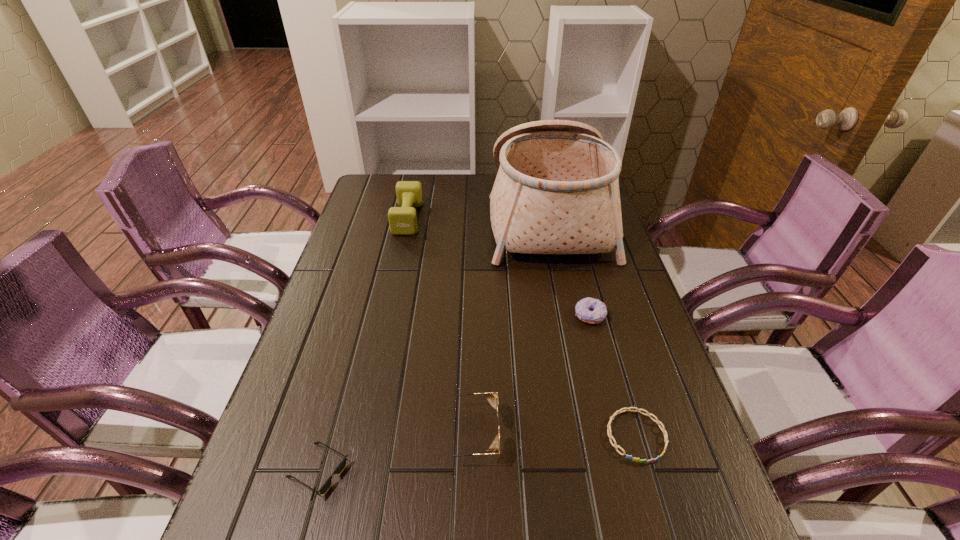
Where is `object that stands as the fourth closest to the shortest object`? This screenshot has width=960, height=540. object that stands as the fourth closest to the shortest object is located at coordinates (342, 465).

Locate which object ranks third in proximity to the bracelet. Please provide its 2D coordinates. Your answer should be formatted as a tuple, i.e. [(x, y)], where the tuple contains the x and y coordinates of a point satisfying the conditions above.

[(557, 190)]

Find the location of `free space that satisfies the following two spatial constraints: 1. on the front side of the doughnut; 2. on the lenses of the left sunglasses`. free space that satisfies the following two spatial constraints: 1. on the front side of the doughnut; 2. on the lenses of the left sunglasses is located at coordinates [x=630, y=470].

Where is `free point that satisfies the following two spatial constraints: 1. with the lid open on the third farthest object; 2. on the left side of the tallest object`? free point that satisfies the following two spatial constraints: 1. with the lid open on the third farthest object; 2. on the left side of the tallest object is located at coordinates (569, 315).

You are a GUI agent. You are given a task and a screenshot of the screen. Output one action in this format:
    pyautogui.click(x=<x>, y=<y>)
    Task: Click on the vacant space that satisfies the following two spatial constraints: 1. on the surface of the bracelet showing star-shaped elements; 2. on the lenses of the shorter sunglasses
    The height and width of the screenshot is (540, 960).
    Given the screenshot: What is the action you would take?
    pyautogui.click(x=646, y=470)

You are a GUI agent. You are given a task and a screenshot of the screen. Output one action in this format:
    pyautogui.click(x=<x>, y=<y>)
    Task: Click on the free space that satisfies the following two spatial constraints: 1. with the lid open on the fourth tallest object; 2. on the right side of the tallest object
    
    Given the screenshot: What is the action you would take?
    pyautogui.click(x=569, y=315)